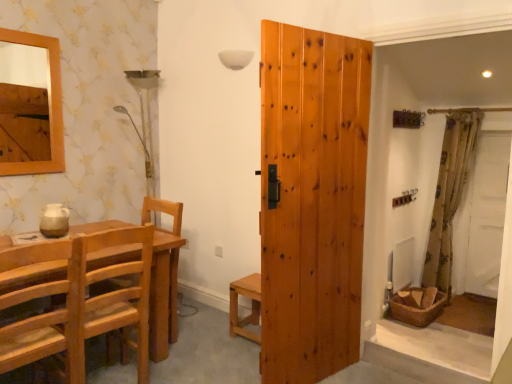
Question: Is floral fabric curtain at right facing towards white fabric screen door at right?

Choices:
 (A) no
 (B) yes

Answer: (A)

Question: Is floral fabric curtain at right next to white fabric screen door at right?

Choices:
 (A) yes
 (B) no

Answer: (B)

Question: Can you confirm if floral fabric curtain at right is thinner than white fabric screen door at right?

Choices:
 (A) no
 (B) yes

Answer: (A)

Question: Is floral fabric curtain at right completely or partially outside of white fabric screen door at right?

Choices:
 (A) yes
 (B) no

Answer: (A)

Question: From a real-world perspective, is floral fabric curtain at right under white fabric screen door at right?

Choices:
 (A) yes
 (B) no

Answer: (B)

Question: Is natural wood door at center taller or shorter than light brown wooden stool at center?

Choices:
 (A) tall
 (B) short

Answer: (A)

Question: Considering the relative positions of natural wood door at center and light brown wooden stool at center in the image provided, is natural wood door at center to the left or to the right of light brown wooden stool at center?

Choices:
 (A) left
 (B) right

Answer: (B)

Question: Is point (292, 62) positioned closer to the camera than point (241, 322)?

Choices:
 (A) farther
 (B) closer

Answer: (B)

Question: Considering the positions of natural wood door at center and light brown wooden stool at center in the image, is natural wood door at center wider or thinner than light brown wooden stool at center?

Choices:
 (A) thin
 (B) wide

Answer: (A)

Question: From their relative heights in the image, would you say natural wood chair at left is taller or shorter than light brown wooden chair at left, placed as the 2th chair when sorted from front to back?

Choices:
 (A) tall
 (B) short

Answer: (A)

Question: Considering the relative positions of natural wood chair at left and light brown wooden chair at left, the 1th chair when ordered from back to front, in the image provided, is natural wood chair at left to the left or to the right of light brown wooden chair at left, the 1th chair when ordered from back to front,?

Choices:
 (A) right
 (B) left

Answer: (A)

Question: Looking at the image, does natural wood chair at left seem bigger or smaller compared to light brown wooden chair at left, the 1th chair when ordered from back to front?

Choices:
 (A) big
 (B) small

Answer: (A)

Question: Is natural wood chair at left situated inside light brown wooden chair at left, the 1th chair when ordered from back to front, or outside?

Choices:
 (A) inside
 (B) outside

Answer: (B)

Question: From the image's perspective, relative to light brown wooden chair at left, placed as the 2th chair when sorted from front to back, is natural wood door at center above or below?

Choices:
 (A) below
 (B) above

Answer: (B)

Question: From their relative heights in the image, would you say natural wood door at center is taller or shorter than light brown wooden chair at left, the 1th chair when ordered from back to front?

Choices:
 (A) tall
 (B) short

Answer: (A)